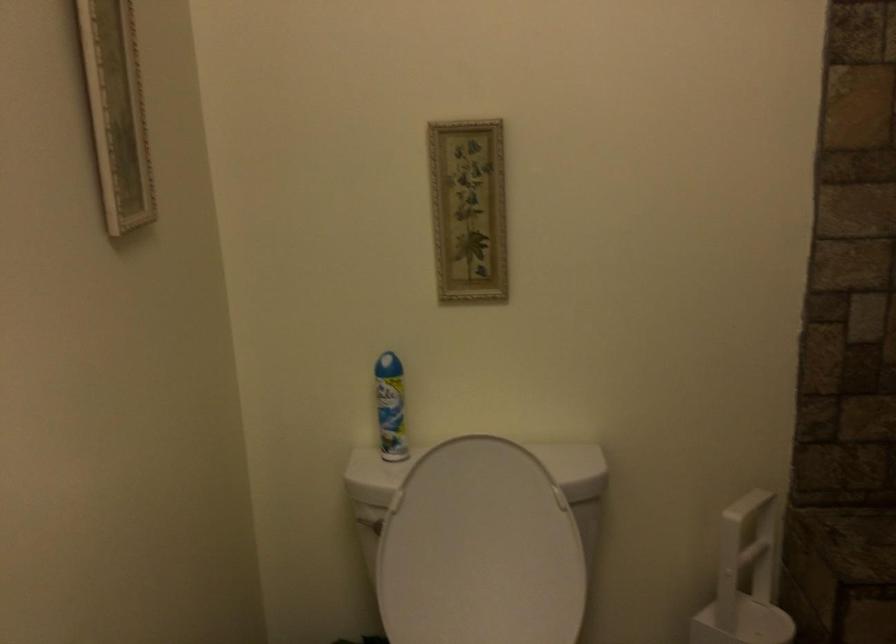
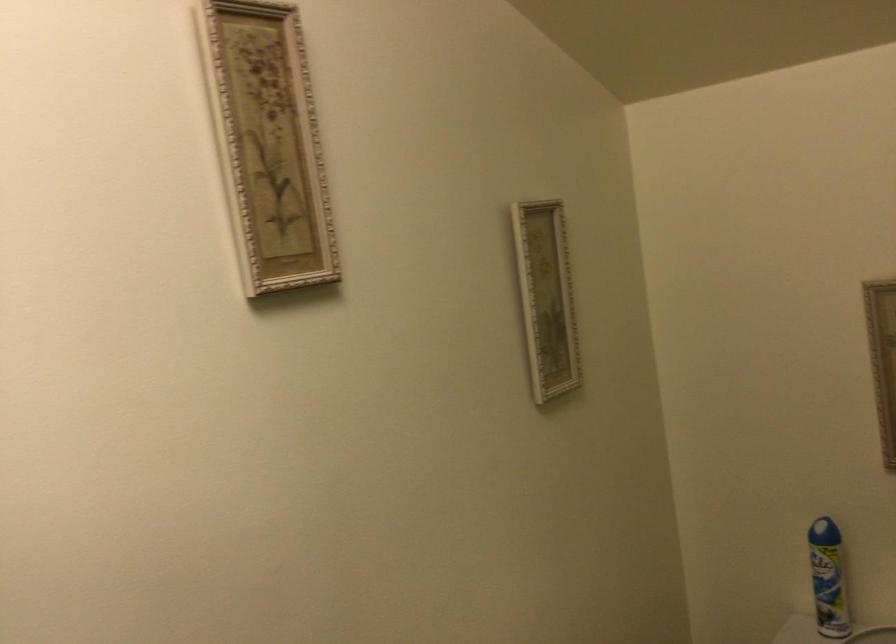
Question: How did the camera likely rotate?

Choices:
 (A) Left
 (B) Right
 (C) Up
 (D) Down

Answer: (A)